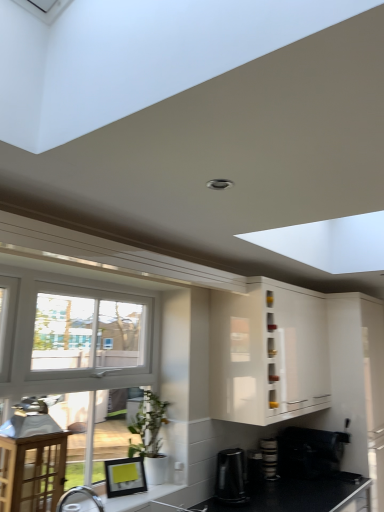
Question: Is black matte countertop at lower right at the right side of white glossy countertop at lower left?

Choices:
 (A) yes
 (B) no

Answer: (A)

Question: Would you say black matte countertop at lower right contains white glossy countertop at lower left?

Choices:
 (A) no
 (B) yes

Answer: (A)

Question: Is white glossy countertop at lower left at the back of black matte countertop at lower right?

Choices:
 (A) no
 (B) yes

Answer: (A)

Question: Is black matte countertop at lower right closer to the viewer compared to white glossy countertop at lower left?

Choices:
 (A) yes
 (B) no

Answer: (B)

Question: Considering the relative sizes of black matte countertop at lower right and white glossy countertop at lower left in the image provided, is black matte countertop at lower right shorter than white glossy countertop at lower left?

Choices:
 (A) no
 (B) yes

Answer: (A)

Question: Is stacked plates at lower right, which appears as the 2th appliance when viewed from the right, to the left or to the right of black plastic coffee maker at lower center, acting as the 4th appliance starting from the right, in the image?

Choices:
 (A) right
 (B) left

Answer: (A)

Question: Do you think stacked plates at lower right, which is the 3th appliance from left to right, is within black plastic coffee maker at lower center, acting as the 4th appliance starting from the right, or outside of it?

Choices:
 (A) inside
 (B) outside

Answer: (B)

Question: Is point (264, 442) positioned closer to the camera than point (240, 474)?

Choices:
 (A) closer
 (B) farther

Answer: (B)

Question: In terms of size, does stacked plates at lower right, which appears as the 2th appliance when viewed from the right, appear bigger or smaller than black plastic coffee maker at lower center, acting as the 4th appliance starting from the right?

Choices:
 (A) small
 (B) big

Answer: (A)

Question: From a real-world perspective, relative to black plastic coffee maker at lower center, which is the 1th appliance from left to right, is white matte pot at lower center vertically above or below?

Choices:
 (A) above
 (B) below

Answer: (A)

Question: From the image's perspective, is white matte pot at lower center above or below black plastic coffee maker at lower center, acting as the 4th appliance starting from the right?

Choices:
 (A) above
 (B) below

Answer: (A)

Question: In terms of width, does white matte pot at lower center look wider or thinner when compared to black plastic coffee maker at lower center, acting as the 4th appliance starting from the right?

Choices:
 (A) thin
 (B) wide

Answer: (A)

Question: Based on their sizes in the image, would you say white matte pot at lower center is bigger or smaller than black plastic coffee maker at lower center, which is the 1th appliance from left to right?

Choices:
 (A) big
 (B) small

Answer: (A)

Question: From a real-world perspective, is black plastic coffee maker at lower center, acting as the 4th appliance starting from the right, positioned above or below black plastic coffee maker at lower center, acting as the 3th appliance starting from the right?

Choices:
 (A) below
 (B) above

Answer: (B)

Question: Is black plastic coffee maker at lower center, acting as the 4th appliance starting from the right, taller or shorter than black plastic coffee maker at lower center, the 2th appliance positioned from the left?

Choices:
 (A) short
 (B) tall

Answer: (B)